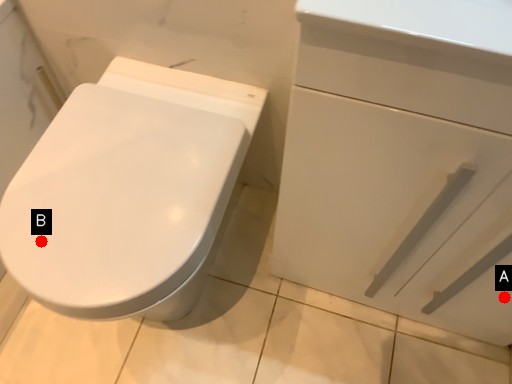
Question: Two points are circled on the image, labeled by A and B beside each circle. Which point is farther to the camera?

Choices:
 (A) A is further
 (B) B is further

Answer: (A)